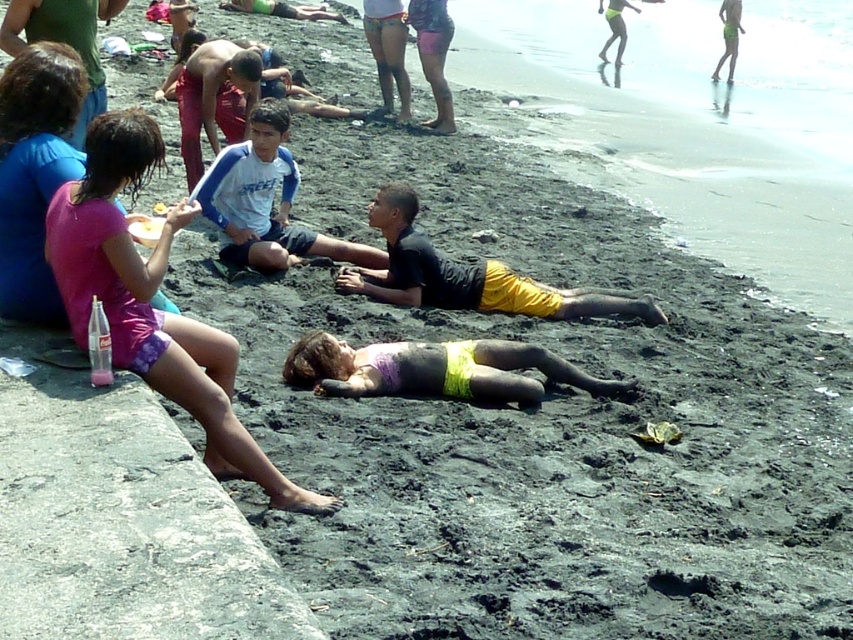
Which of these two, purple fabric shorts at lower left or white cotton shirt at center, stands taller?

purple fabric shorts at lower left

Which is below, purple fabric shorts at lower left or white cotton shirt at center?

purple fabric shorts at lower left is lower down.

Between point (131, 304) and point (202, 195), which one is positioned behind?

Positioned behind is point (202, 195).

Image resolution: width=853 pixels, height=640 pixels. What are the coordinates of `purple fabric shorts at lower left` in the screenshot? It's located at (149, 305).

Is purple fabric shorts at lower left to the right of matte purple bikini top at center from the viewer's perspective?

No, purple fabric shorts at lower left is not to the right of matte purple bikini top at center.

Can you confirm if purple fabric shorts at lower left is bigger than matte purple bikini top at center?

Correct, purple fabric shorts at lower left is larger in size than matte purple bikini top at center.

Which is behind, point (164, 237) or point (448, 394)?

The point (448, 394) is more distant.

The image size is (853, 640). Identify the location of purple fabric shorts at lower left. (149, 305).

Does matte purple bikini top at center appear on the left side of white cotton shirt at center?

→ Incorrect, matte purple bikini top at center is not on the left side of white cotton shirt at center.

Between matte purple bikini top at center and white cotton shirt at center, which one is positioned higher?

Positioned higher is white cotton shirt at center.

Who is more forward, (427, 348) or (256, 145)?

Point (427, 348) is more forward.

Locate an element on the screen. The width and height of the screenshot is (853, 640). matte purple bikini top at center is located at coordinates (434, 369).